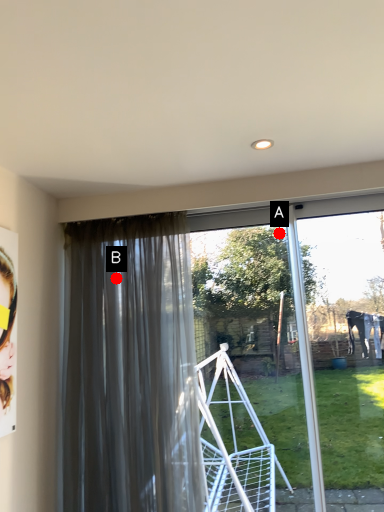
Question: Two points are circled on the image, labeled by A and B beside each circle. Among these points, which one is farthest from the camera?

Choices:
 (A) A is further
 (B) B is further

Answer: (A)